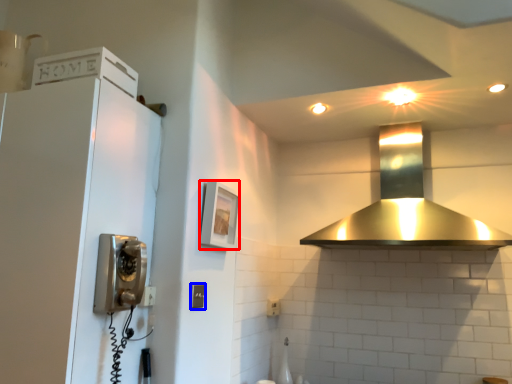
Question: Which object is closer to the camera taking this photo, picture frame (highlighted by a red box) or light switch (highlighted by a blue box)?

Choices:
 (A) picture frame
 (B) light switch

Answer: (B)